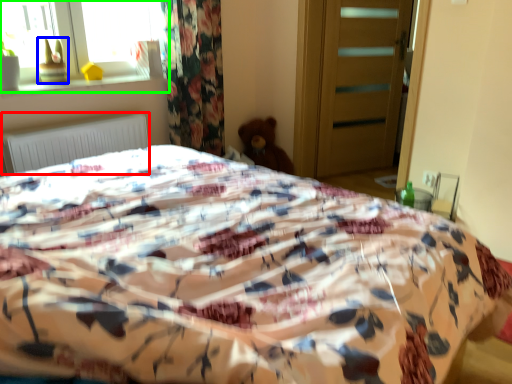
Question: Considering the real-world distances, which object is closest to radiator (highlighted by a red box)? toy (highlighted by a blue box) or window (highlighted by a green box).

Choices:
 (A) toy
 (B) window

Answer: (A)